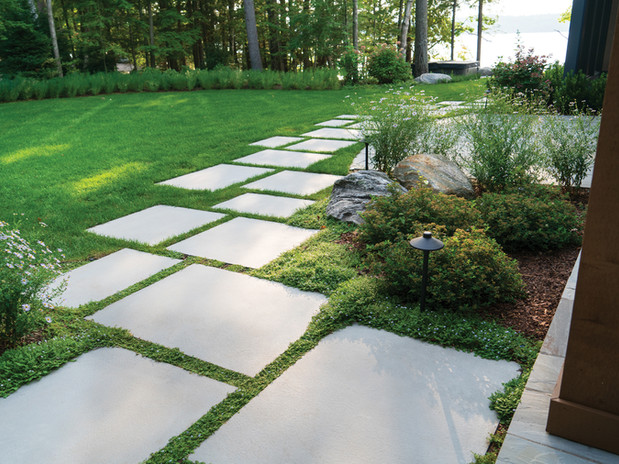
You are a GUI agent. You are given a task and a screenshot of the screen. Output one action in this format:
    pyautogui.click(x=<x>, y=<y>)
    Task: Click on the flower bunch
    
    Given the screenshot: What is the action you would take?
    pyautogui.click(x=10, y=284), pyautogui.click(x=392, y=121), pyautogui.click(x=511, y=128), pyautogui.click(x=574, y=142)